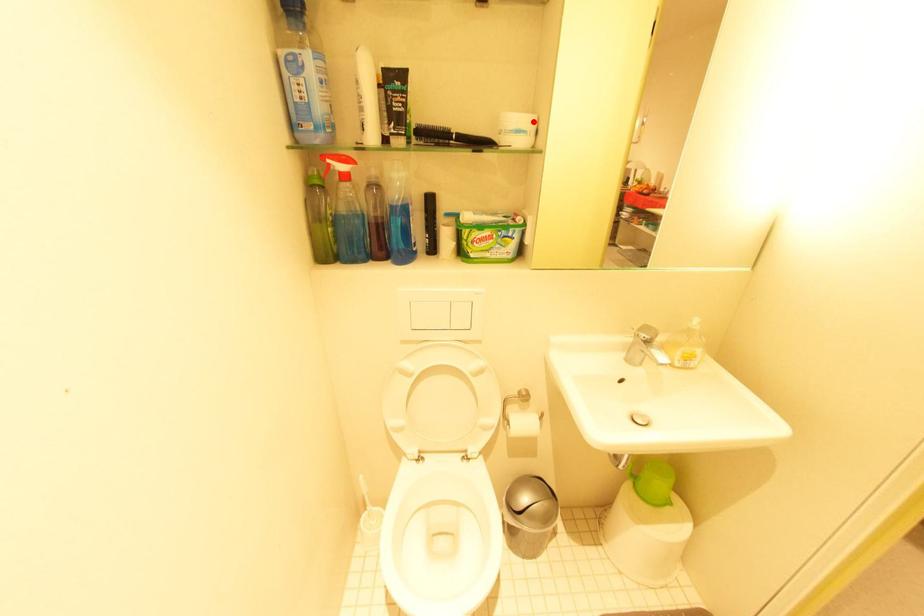
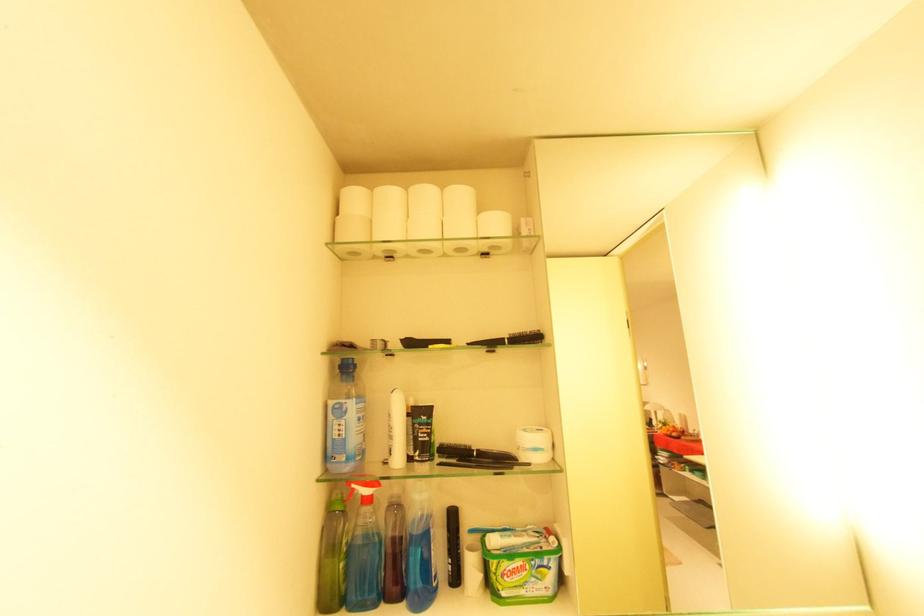
The point at the highlighted location is marked in the first image. Where is the corresponding point in the second image?

(549, 440)